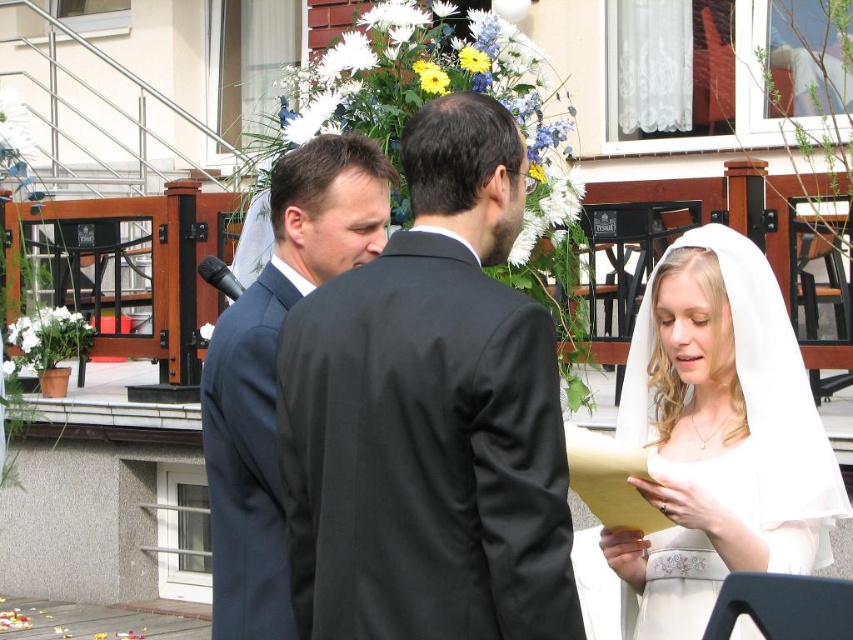
You are a photographer at a wedding ceremony. You need to capture a closeup shot of the groom wearing a suit. There are two suits visible in the scene, a matte black suit at center and a dark blue suit at center. Which one should you focus on to ensure the groom is properly captured?

The matte black suit at center is larger in size than the dark blue suit at center, so the photographer should focus on the matte black suit at center to ensure the groom is properly captured.

You are a photographer capturing the wedding ceremony from a position where the white satin veil at upper right is in your view. Based on its coordinates, can you estimate its location relative to the center of the image?

The white satin veil at upper right is located at coordinates point (424, 410). This places it slightly to the right and just below the center of the image.